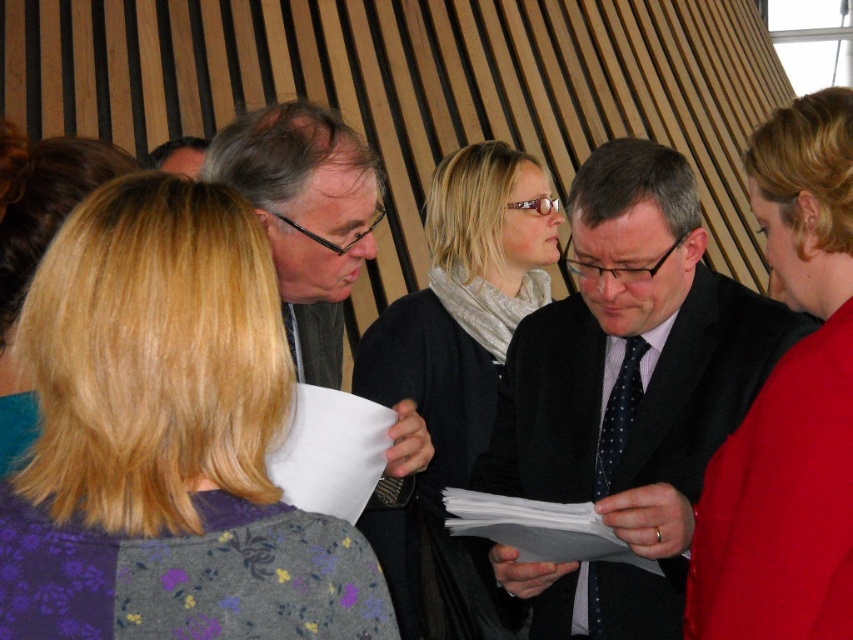
You are a GUI agent. You are given a task and a screenshot of the screen. Output one action in this format:
    pyautogui.click(x=<x>, y=<y>)
    Task: Click on the matte black suit at center
    The image size is (853, 640).
    Given the screenshot: What is the action you would take?
    pyautogui.click(x=627, y=392)

Does matte black suit at center appear on the right side of matte black glasses at center?

Indeed, matte black suit at center is positioned on the right side of matte black glasses at center.

The image size is (853, 640). In order to click on matte black suit at center in this screenshot , I will do `click(627, 392)`.

Is matte red sweater at center to the right of silver metallic scarf at center from the viewer's perspective?

Yes, matte red sweater at center is to the right of silver metallic scarf at center.

Is matte red sweater at center behind silver metallic scarf at center?

No, matte red sweater at center is in front of silver metallic scarf at center.

Between point (804, 630) and point (370, 506), which one is positioned in front?

Point (804, 630)

Identify the location of matte red sweater at center. This screenshot has height=640, width=853. (788, 406).

Is point (334, 627) positioned behind point (593, 496)?

No, (334, 627) is in front of (593, 496).

Is blonde hair at center below dark blue dotted tie at center?

Actually, blonde hair at center is above dark blue dotted tie at center.

Between point (97, 614) and point (599, 600), which one is positioned behind?

Point (599, 600)

Where is `blonde hair at center`? The width and height of the screenshot is (853, 640). blonde hair at center is located at coordinates (167, 440).